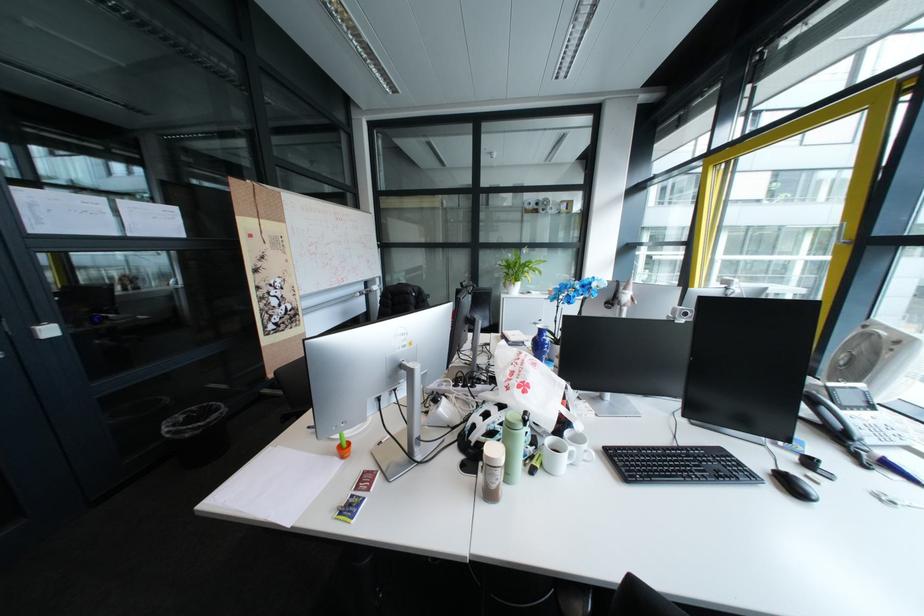
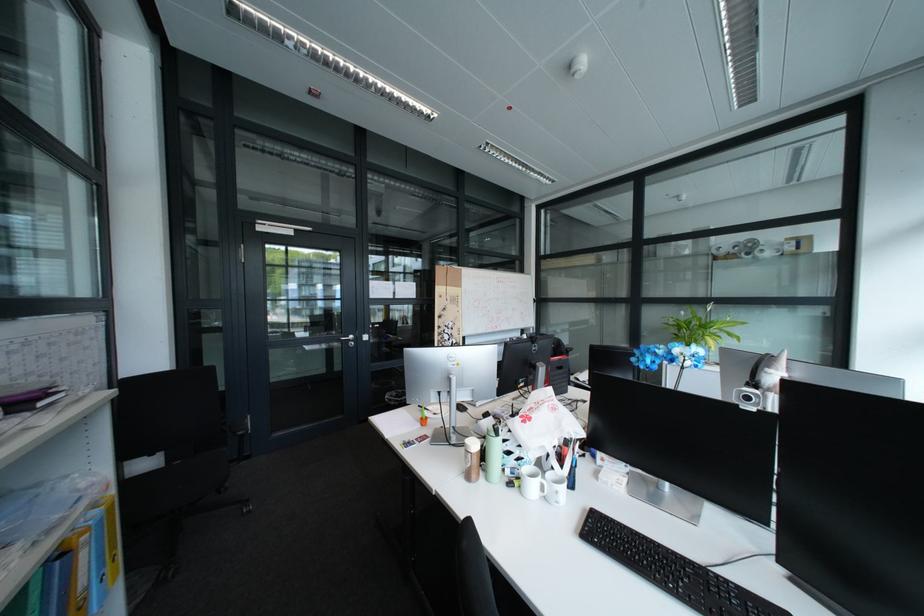
Question: The camera is either moving clockwise (left) or counter-clockwise (right) around the object. The first image is from the beginning of the video and the second image is from the end. Is the camera moving left or right when shooting the video?

Choices:
 (A) Left
 (B) Right

Answer: (B)